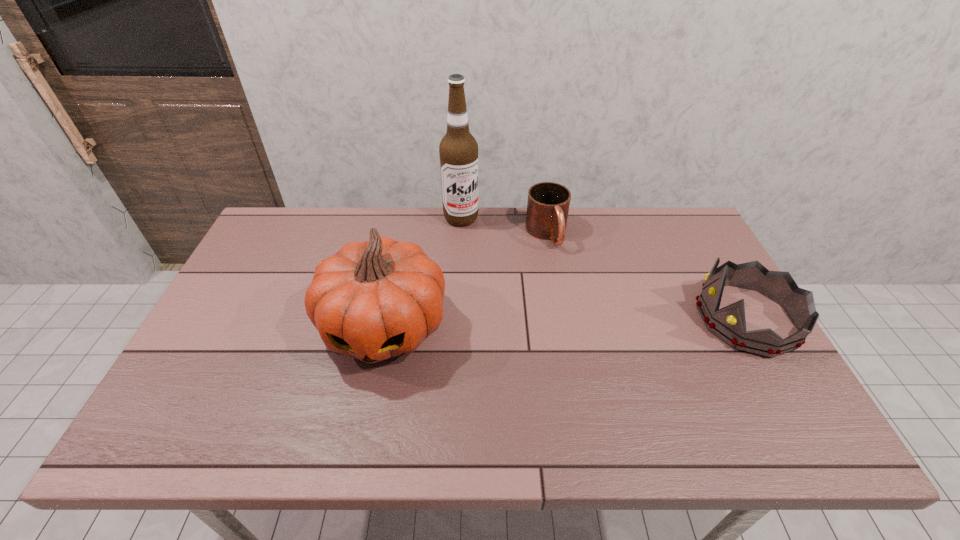
Find the location of a particular element. This screenshot has height=540, width=960. vacant space on the desktop that is between the pumpkin and the third tallest object and is positioned on the side of the third object from left to right with the handle is located at coordinates click(x=594, y=322).

At what (x,y) coordinates should I click in order to perform the action: click on free space on the desktop that is between the third shortest object and the rightmost object and is positioned on the label of the alcohol. Please return your answer as a coordinate pair (x, y). Looking at the image, I should click on (515, 323).